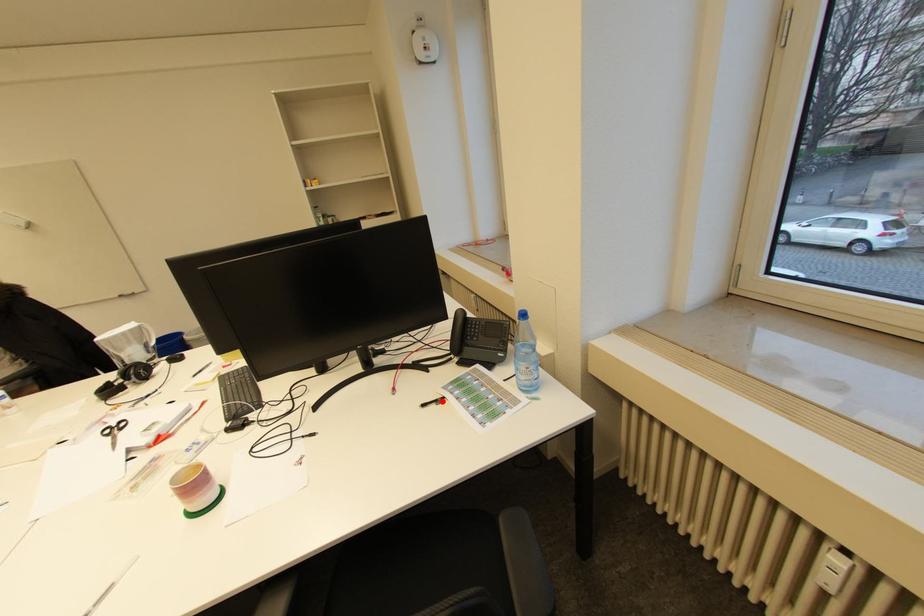
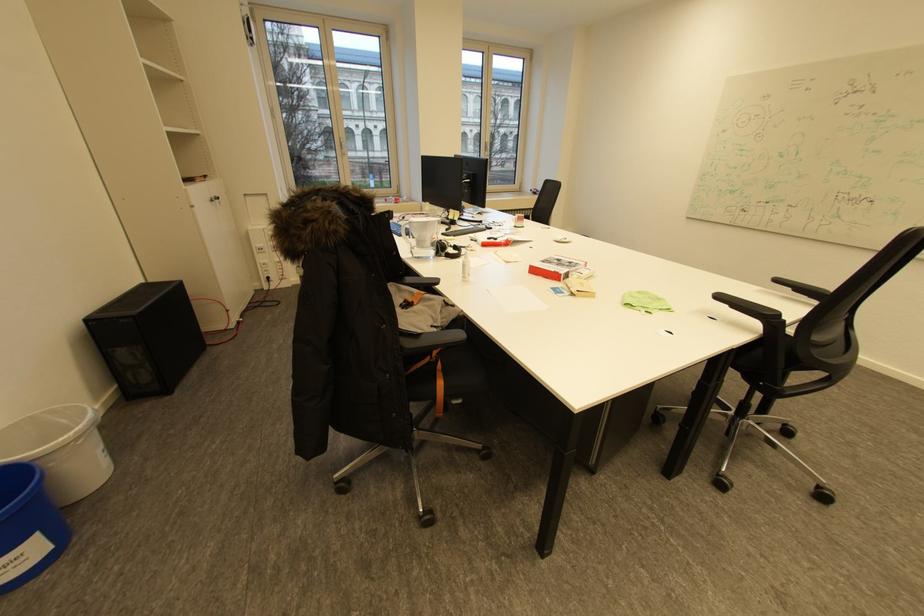
Question: I am providing you with two images of the same scene from different viewpoints. A red point is marked on the first image. Can you still see the location of the red point in image 2?

Choices:
 (A) Yes
 (B) No

Answer: (B)